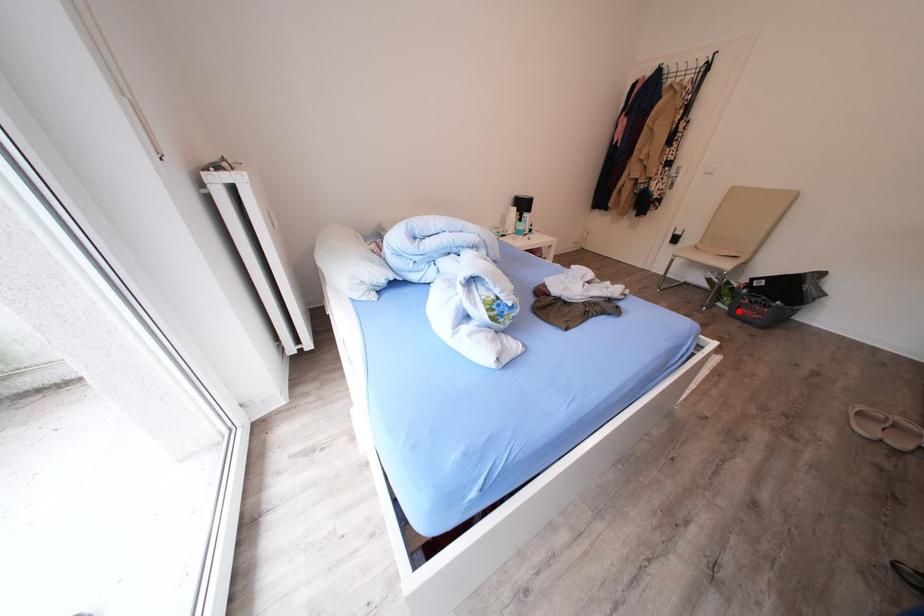
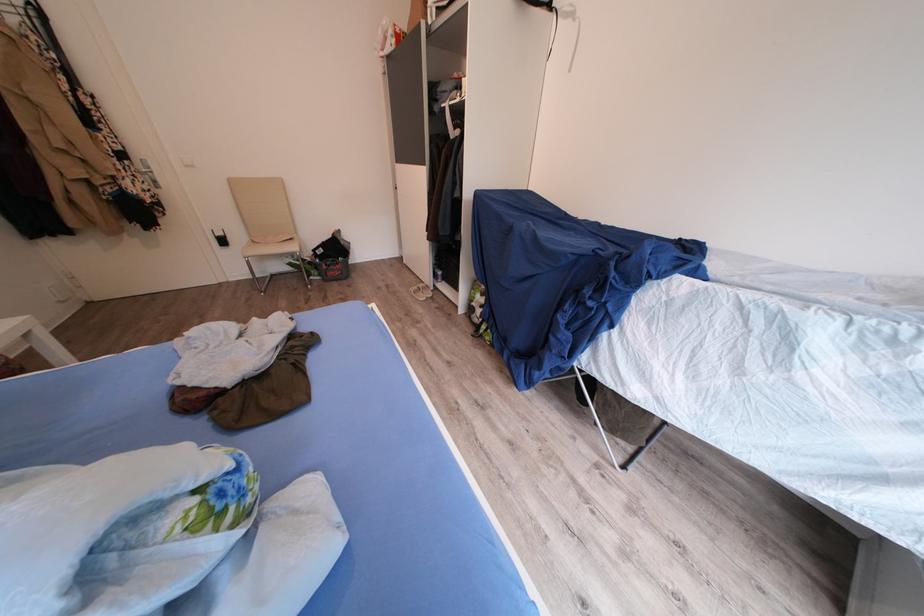
Find the pixel in the second image that matches the highlighted location in the first image.

(329, 281)